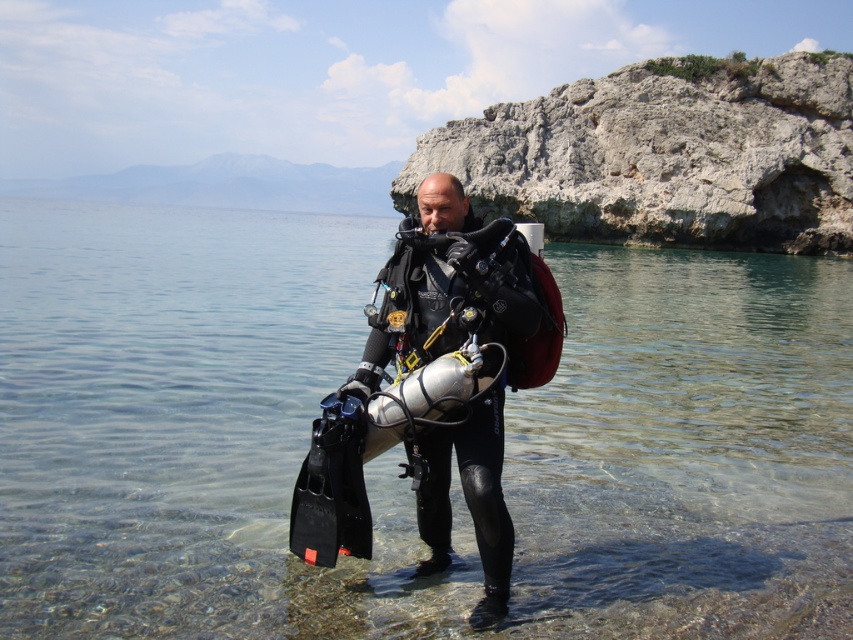
You are a safety officer assessing the diving site. The safety protocol requires that the clear water at center must be at least 7 meters away from the diver for safety. Is the current distance compliant with the protocol?

The clear water at center is 7.45 meters away from the viewer, which exceeds the required 7 meters, so it is compliant with the safety protocol.

Looking at this image, you are a lifeguard on duty and notice a diver in the water. You see the clear water at center and the black matte wetsuit at center. Which object is above the other?

The clear water at center is located above the black matte wetsuit at center.

You are a marine biologist studying the underwater environment. You observe the clear water at center. Based on its coordinates, can you determine if it is located in the upper or lower half of the image?

The clear water at center is located at point coordinates of 0.669 on the x axis and 0.224 on the y axis. Since the y coordinate is less than 0.5, it is in the lower half of the image.